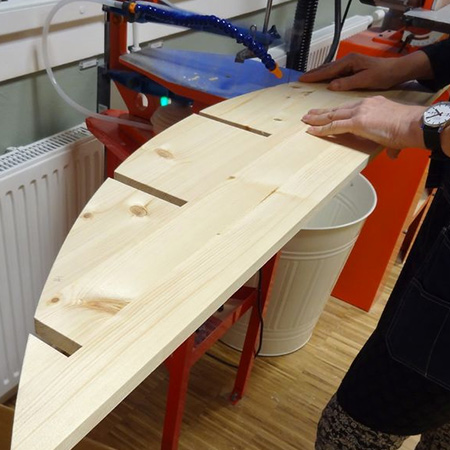
Image resolution: width=450 pixels, height=450 pixels. Find the location of `floor`. floor is located at coordinates point(284,375).